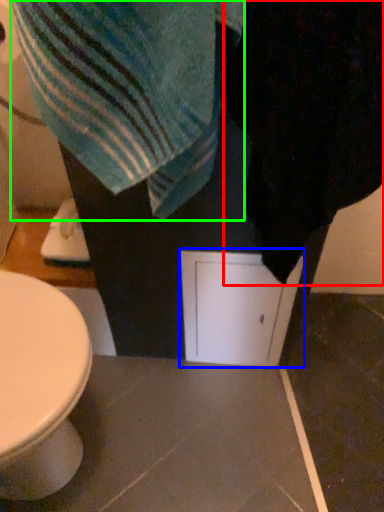
Question: Which is nearer to the bath towel (highlighted by a red box)? screen door (highlighted by a blue box) or beach towel (highlighted by a green box).

Choices:
 (A) screen door
 (B) beach towel

Answer: (B)